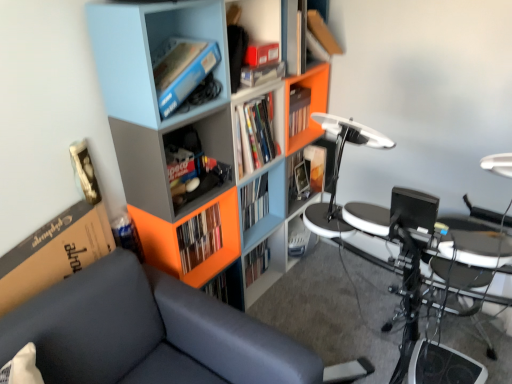
Image resolution: width=512 pixels, height=384 pixels. Identify the location of free location to the right of matte plastic cabinet at center. (331, 256).